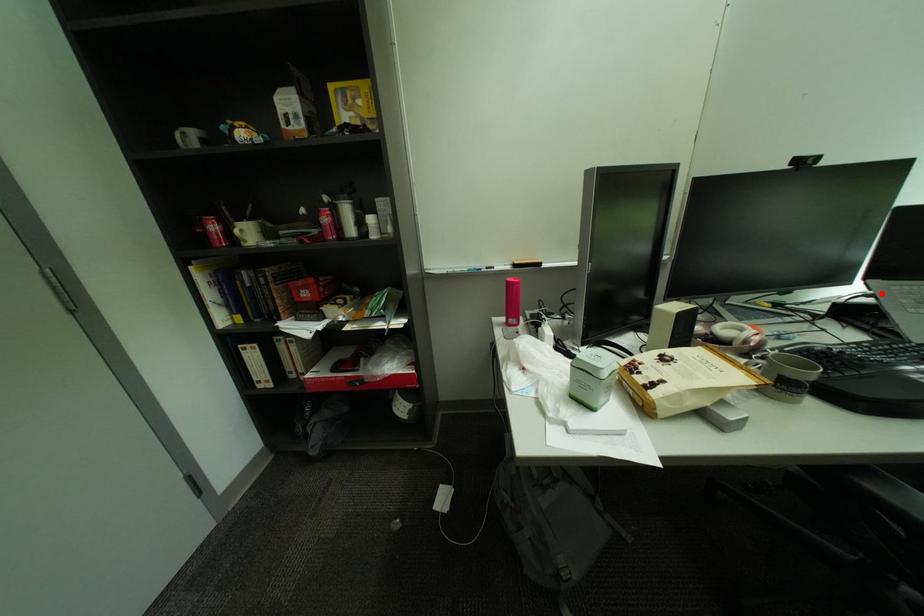
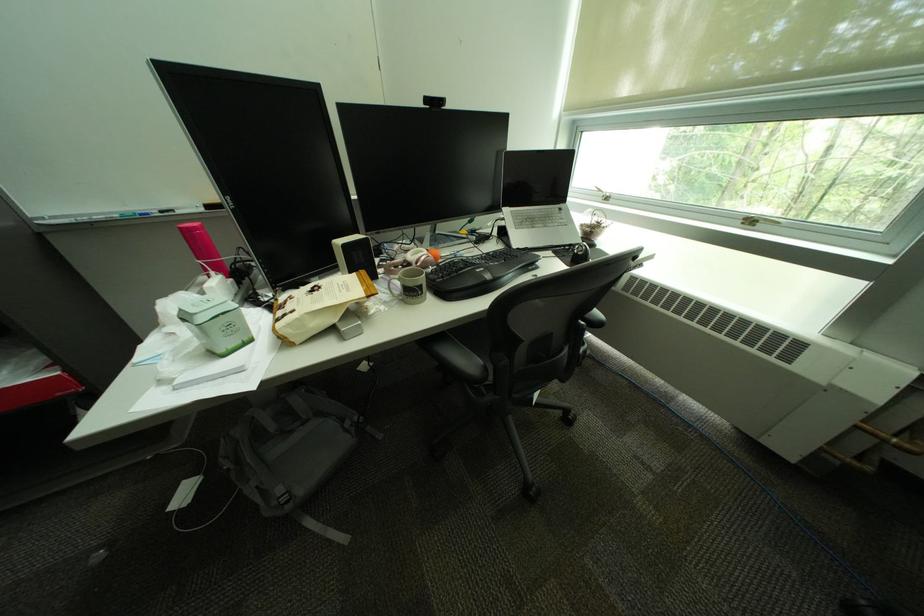
The point at the highlighted location is marked in the first image. Where is the corresponding point in the second image?

(514, 217)